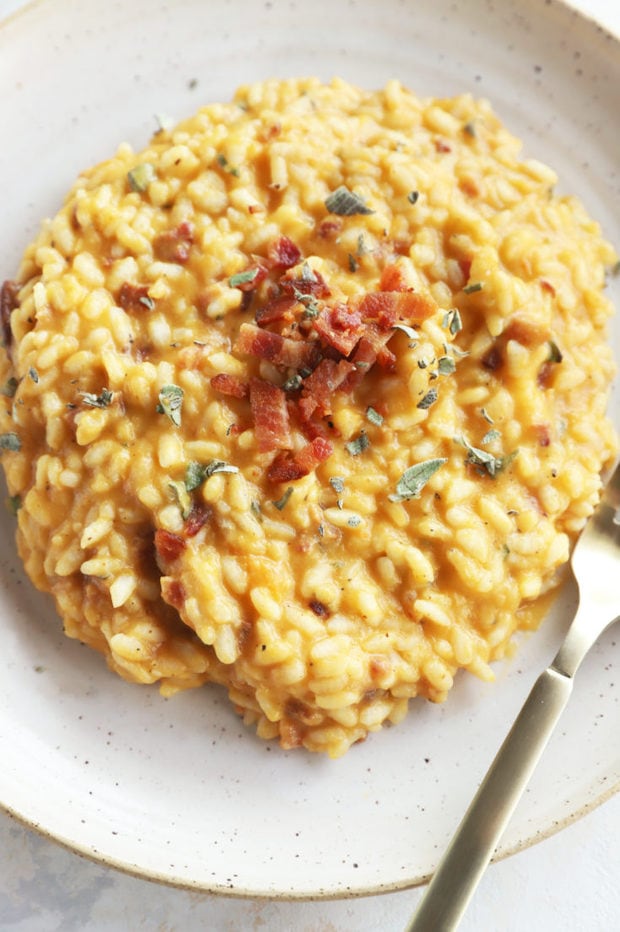
You are a GUI agent. You are given a task and a screenshot of the screen. Output one action in this format:
    pyautogui.click(x=<x>, y=<y>)
    Task: Click on the plate
    
    Given the screenshot: What is the action you would take?
    pyautogui.click(x=301, y=801)